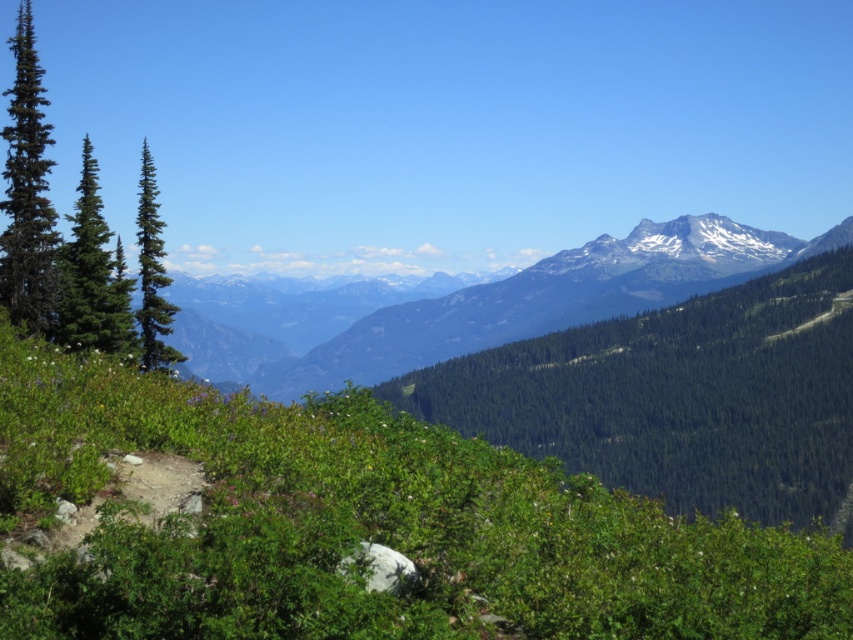
Question: Is green leafy tree at center to the left of green matte tree at left from the viewer's perspective?

Choices:
 (A) no
 (B) yes

Answer: (A)

Question: Among these points, which one is farthest from the camera?

Choices:
 (A) (471, 298)
 (B) (4, 204)
 (C) (730, 483)
 (D) (146, 147)

Answer: (A)

Question: Does green forested mountain range at center appear on the right side of green matte evergreen tree at left?

Choices:
 (A) yes
 (B) no

Answer: (A)

Question: Which point is closer to the camera?

Choices:
 (A) (581, 260)
 (B) (149, 170)
 (C) (86, 262)
 (D) (724, 348)

Answer: (C)

Question: Is green leafy tree at center positioned before green matte evergreen tree at left?

Choices:
 (A) no
 (B) yes

Answer: (A)

Question: Estimate the real-world distances between objects in this image. Which object is closer to the green matte tree at left?

Choices:
 (A) green leafy tree at center
 (B) green matte evergreen tree at left

Answer: (B)